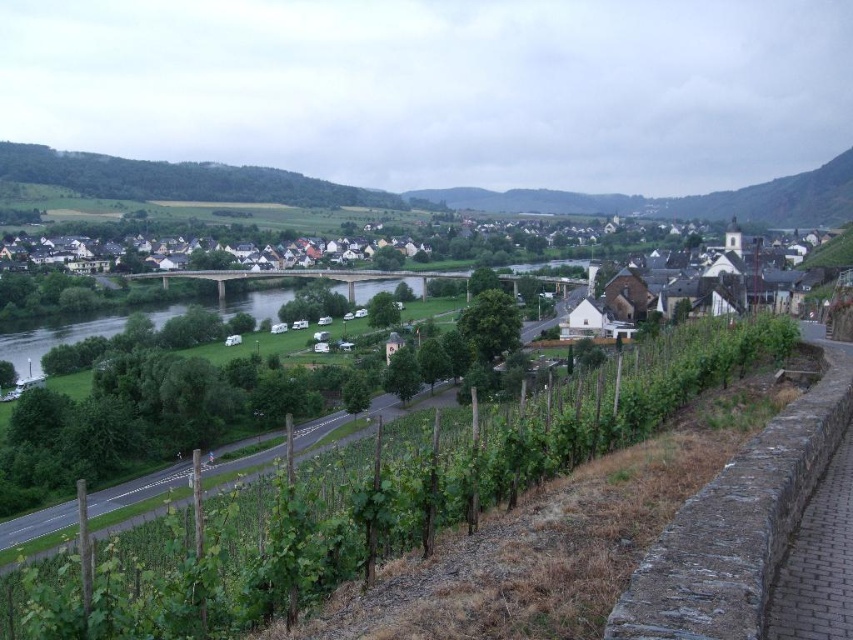
You are planning a picnic and need to choose between setting up in the green leafy vineyard at lower left or the brick paved path at lower right. Based on their sizes, which location offers more space for your picnic setup?

The green leafy vineyard at lower left has a larger size compared to the brick paved path at lower right, so it offers more space for your picnic setup.

You are standing at the origin point of the coordinate system in the image. You want to walk towards the green leafy vineyard at lower left. Which direction should you head?

The green leafy vineyard at lower left is located at coordinate point 0.781 on the x axis and 0.438 on the y axis. Since the origin is at the bottom left corner, you should move towards the northeast direction to reach it.

Looking at this image, you are a hiker who wants to take a photo of the green leafy vineyard at lower left and the brick paved path at lower right. Which object is located to the left of the other?

The green leafy vineyard at lower left is positioned on the left side of the brick paved path at lower right.